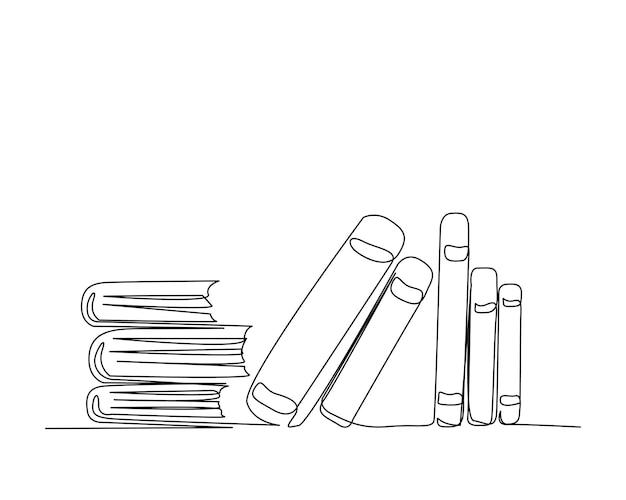
Where is `book`? The image size is (626, 500). book is located at coordinates (167, 306), (175, 356), (160, 404), (313, 330), (356, 355), (453, 342), (483, 350), (516, 359).